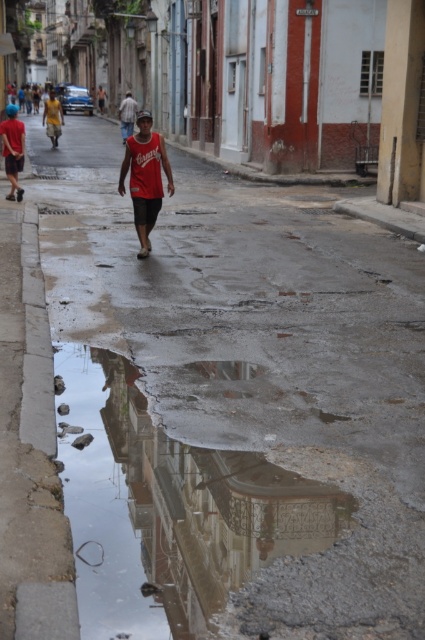
Question: Which object is the farthest from the reflective concrete puddle at center?

Choices:
 (A) red cotton shirt at center
 (B) matte red tank top at center

Answer: (A)

Question: Is the position of reflective concrete puddle at center less distant than that of matte red tank top at center?

Choices:
 (A) yes
 (B) no

Answer: (A)

Question: Which object is closer to the camera taking this photo?

Choices:
 (A) matte red tank top at center
 (B) reflective concrete puddle at center

Answer: (B)

Question: Is the position of reflective concrete puddle at center less distant than that of matte red tank top at center?

Choices:
 (A) yes
 (B) no

Answer: (A)

Question: Based on their relative distances, which object is nearer to the matte red tank top at center?

Choices:
 (A) red cotton shirt at center
 (B) reflective concrete puddle at center

Answer: (B)

Question: Considering the relative positions of matte red tank top at center and red cotton shirt at center in the image provided, where is matte red tank top at center located with respect to red cotton shirt at center?

Choices:
 (A) above
 (B) below

Answer: (B)